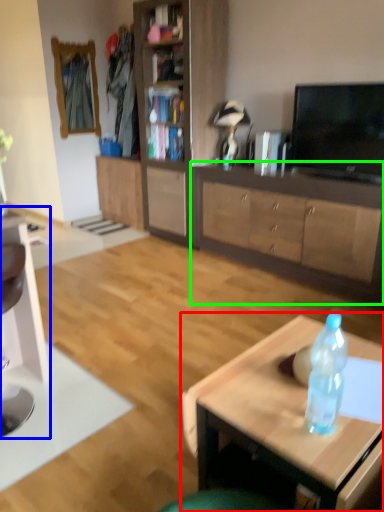
Question: Which object is the closest to the coffee table (highlighted by a red box)? Choose among these: computer desk (highlighted by a blue box) or cabinetry (highlighted by a green box).

Choices:
 (A) computer desk
 (B) cabinetry

Answer: (A)